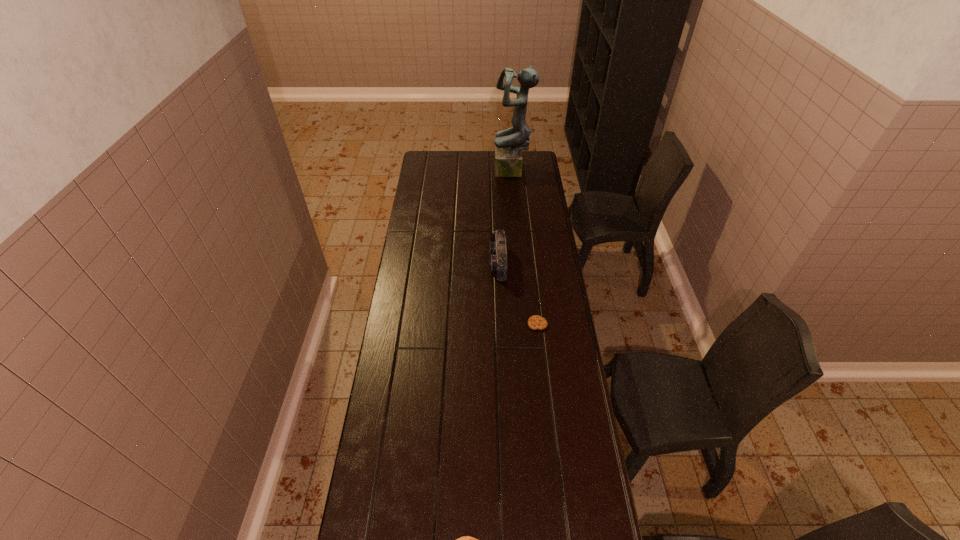
You are a GUI agent. You are given a task and a screenshot of the screen. Output one action in this format:
    pyautogui.click(x=<x>, y=<y>)
    Task: Click on the empty space between the third farthest object and the camcorder
    Image resolution: width=960 pixels, height=540 pixels.
    Given the screenshot: What is the action you would take?
    pyautogui.click(x=517, y=293)

Find the location of a particular element. The image size is (960, 540). vacant area between the sculpture and the second tallest object is located at coordinates (505, 218).

Locate an element on the screen. vacant point located between the sculpture and the second nearest object is located at coordinates click(525, 248).

This screenshot has width=960, height=540. Identify the location of empty space between the sculpture and the third nearest object. (505, 218).

Select which object is the closest to the left cookie. Please provide its 2D coordinates. Your answer should be formatted as a tuple, i.e. [(x, y)], where the tuple contains the x and y coordinates of a point satisfying the conditions above.

[(535, 322)]

You are a GUI agent. You are given a task and a screenshot of the screen. Output one action in this format:
    pyautogui.click(x=<x>, y=<y>)
    Task: Click on the object that can be found as the third closest to the second nearest object
    
    Given the screenshot: What is the action you would take?
    pyautogui.click(x=509, y=143)

You are a GUI agent. You are given a task and a screenshot of the screen. Output one action in this format:
    pyautogui.click(x=<x>, y=<y>)
    Task: Click on the free space in the image that satisfies the following two spatial constraints: 1. on the face of the tallest object; 2. on the right side of the third farthest object
    Image resolution: width=960 pixels, height=540 pixels.
    Given the screenshot: What is the action you would take?
    pyautogui.click(x=526, y=323)

Where is `free spot that satisfies the following two spatial constraints: 1. on the face of the tallest object; 2. on the back side of the right cookie`? free spot that satisfies the following two spatial constraints: 1. on the face of the tallest object; 2. on the back side of the right cookie is located at coordinates (526, 323).

Find the location of a particular element. free space that satisfies the following two spatial constraints: 1. on the front-facing side of the third shortest object; 2. on the left side of the right cookie is located at coordinates (501, 323).

At what (x,y) coordinates should I click in order to perform the action: click on vacant position in the image that satisfies the following two spatial constraints: 1. on the face of the sculpture; 2. on the left side of the right cookie. Please return your answer as a coordinate pair (x, y). Looking at the image, I should click on (526, 323).